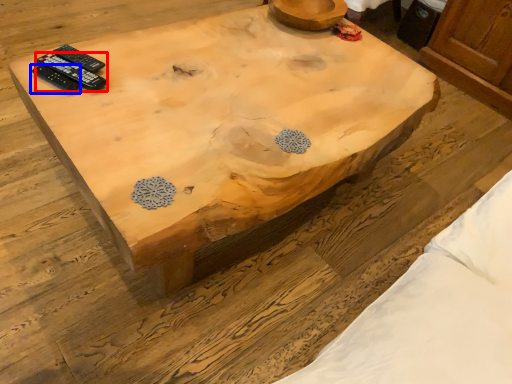
Question: Which object is further to the camera taking this photo, remote control (highlighted by a red box) or remote control (highlighted by a blue box)?

Choices:
 (A) remote control
 (B) remote control

Answer: (A)